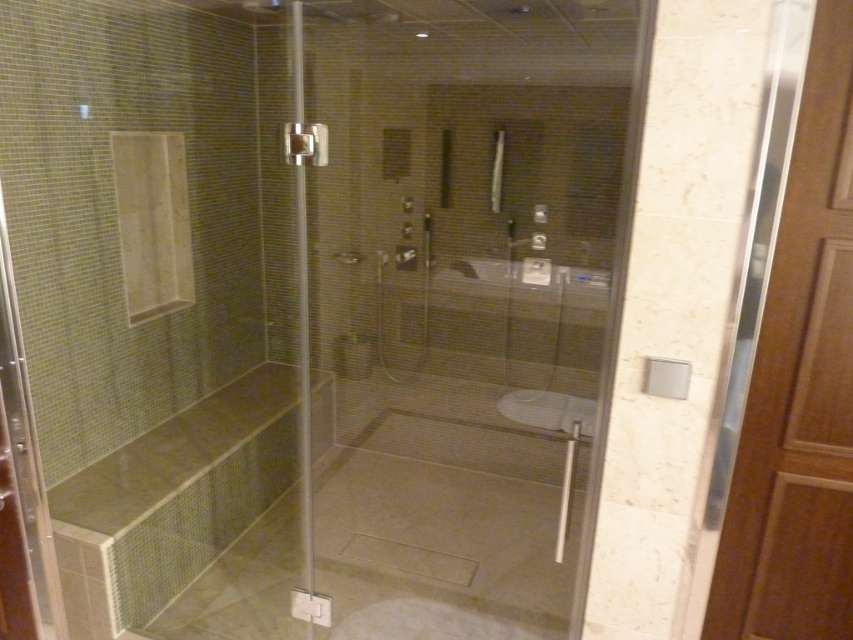
From the picture: You are designing a shower enclosure and need to ensure that the transparent glass door at center and the clear glass screen door at right fit within a height restriction of 2 meters. Given their height relationship, which door would you prioritize for installation if space is limited?

The transparent glass door at center is taller than the clear glass screen door at right, so you should prioritize installing the clear glass screen door at right first since it is shorter and fits better within the height restriction.

You are designing a layout for a bathroom renovation and need to ensure that the clear glass screen door at right and the satin nickel hinge at upper center are appropriately sized. Based on the image, which object is bigger?

The clear glass screen door at right is larger in size than the satin nickel hinge at upper center.

You are standing in the shower area and want to locate the point at coordinates point (x=459, y=307). According to the scene description, where exactly is this point located?

The point (x=459, y=307) is on the transparent glass door at center.